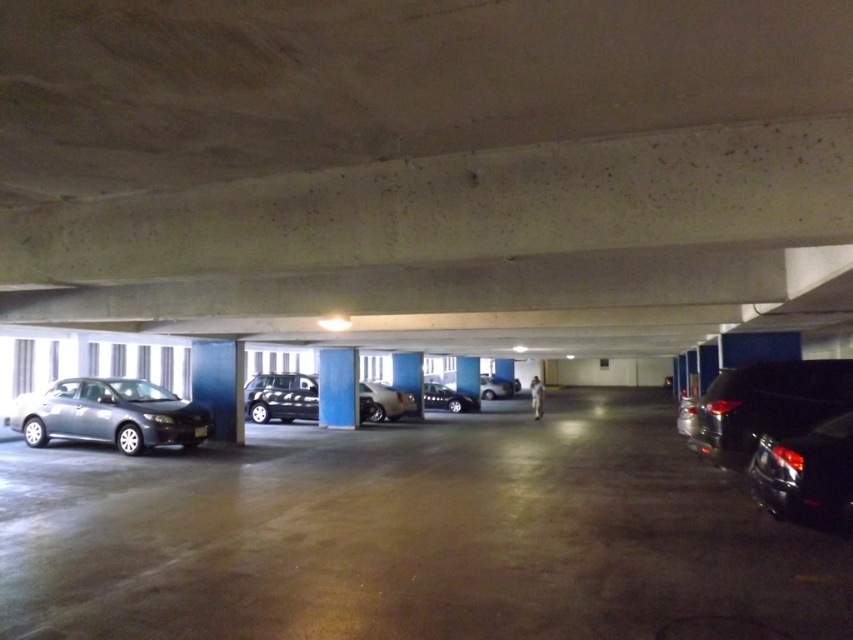
Question: Which point appears farthest from the camera in this image?

Choices:
 (A) (190, 429)
 (B) (305, 604)

Answer: (A)

Question: Which of these objects is positioned closest to the satin black sedan at center?

Choices:
 (A) black matte car at right
 (B) black glossy car at right

Answer: (A)

Question: Is metallic gray car at left further to camera compared to black matte car at right?

Choices:
 (A) no
 (B) yes

Answer: (A)

Question: Which point appears farthest from the camera in this image?

Choices:
 (A) (491, 394)
 (B) (836, 518)
 (C) (471, 410)

Answer: (A)

Question: Can you confirm if metallic gray car at left is positioned to the left of silver metallic sedan at center?

Choices:
 (A) yes
 (B) no

Answer: (A)

Question: Can you confirm if black glossy car at right is bigger than shiny black suv at center?

Choices:
 (A) no
 (B) yes

Answer: (A)